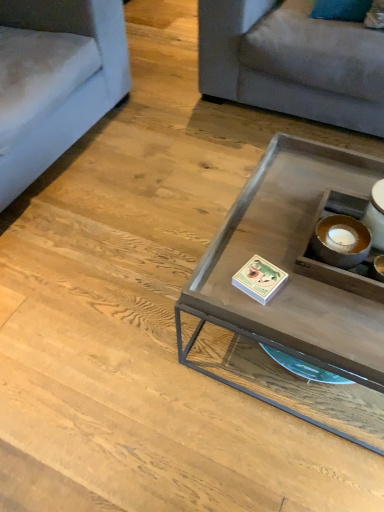
Locate an element on the screen. Image resolution: width=384 pixels, height=512 pixels. light blue fabric couch at left, which is the second studio couch in right-to-left order is located at coordinates (55, 80).

This screenshot has height=512, width=384. Describe the element at coordinates (55, 80) in the screenshot. I see `light blue fabric couch at left, which is the second studio couch in right-to-left order` at that location.

Describe the element at coordinates (292, 62) in the screenshot. I see `light gray fabric couch at upper right, which is counted as the second studio couch, starting from the left` at that location.

Describe the element at coordinates (295, 294) in the screenshot. I see `matte glass coffee table at center` at that location.

This screenshot has width=384, height=512. Identify the location of light blue fabric couch at left, acting as the first studio couch starting from the left. (55, 80).

Is matte glass coffee table at center taller than light blue fabric couch at left, acting as the first studio couch starting from the left?

No, matte glass coffee table at center is not taller than light blue fabric couch at left, acting as the first studio couch starting from the left.

Considering the relative positions of matte glass coffee table at center and light blue fabric couch at left, acting as the first studio couch starting from the left, in the image provided, is matte glass coffee table at center behind light blue fabric couch at left, acting as the first studio couch starting from the left,?

No, it is not.

Is matte glass coffee table at center positioned with its back to light blue fabric couch at left, acting as the first studio couch starting from the left?

matte glass coffee table at center does not have its back to light blue fabric couch at left, acting as the first studio couch starting from the left.

From the image's perspective, which studio couch is the 1st one above the matte glass coffee table at center? Please provide its 2D coordinates.

[(55, 80)]

Measure the distance from matte glass coffee table at center to light gray fabric couch at upper right, which is counted as the second studio couch, starting from the left.

matte glass coffee table at center is 36.88 inches from light gray fabric couch at upper right, which is counted as the second studio couch, starting from the left.

Considering the relative sizes of matte glass coffee table at center and light gray fabric couch at upper right, the 1th studio couch from the right, in the image provided, is matte glass coffee table at center wider than light gray fabric couch at upper right, the 1th studio couch from the right,?

No, matte glass coffee table at center is not wider than light gray fabric couch at upper right, the 1th studio couch from the right.

You are a GUI agent. You are given a task and a screenshot of the screen. Output one action in this format:
    pyautogui.click(x=<x>, y=<y>)
    Task: Click on the 2nd studio couch behind the matte glass coffee table at center
    This screenshot has width=384, height=512.
    Given the screenshot: What is the action you would take?
    pyautogui.click(x=292, y=62)

What's the angular difference between matte glass coffee table at center and light gray fabric couch at upper right, the 1th studio couch from the right,'s facing directions?

The facing directions of matte glass coffee table at center and light gray fabric couch at upper right, the 1th studio couch from the right, are 89.8 degrees apart.

Considering the positions of objects light blue fabric couch at left, which is the second studio couch in right-to-left order, and matte glass coffee table at center in the image provided, who is more to the right, light blue fabric couch at left, which is the second studio couch in right-to-left order, or matte glass coffee table at center?

Positioned to the right is matte glass coffee table at center.

Is there a large distance between light blue fabric couch at left, which is the second studio couch in right-to-left order, and matte glass coffee table at center?

Indeed, light blue fabric couch at left, which is the second studio couch in right-to-left order, is not near matte glass coffee table at center.

Which object is closer to the camera, light blue fabric couch at left, which is the second studio couch in right-to-left order, or matte glass coffee table at center?

Positioned in front is matte glass coffee table at center.

How different are the orientations of light blue fabric couch at left, which is the second studio couch in right-to-left order, and matte glass coffee table at center in degrees?

88.6 degrees separate the facing orientations of light blue fabric couch at left, which is the second studio couch in right-to-left order, and matte glass coffee table at center.

Is light gray fabric couch at upper right, which is counted as the second studio couch, starting from the left, shorter than matte glass coffee table at center?

No, light gray fabric couch at upper right, which is counted as the second studio couch, starting from the left, is not shorter than matte glass coffee table at center.

In terms of width, does light gray fabric couch at upper right, which is counted as the second studio couch, starting from the left, look wider or thinner when compared to matte glass coffee table at center?

Considering their sizes, light gray fabric couch at upper right, which is counted as the second studio couch, starting from the left, looks broader than matte glass coffee table at center.

In the image, there is a light gray fabric couch at upper right, the 1th studio couch from the right. Identify the location of coffee table below it (from the image's perspective). The height and width of the screenshot is (512, 384). (295, 294).

Which object is wider, light blue fabric couch at left, acting as the first studio couch starting from the left, or light gray fabric couch at upper right, the 1th studio couch from the right?

light gray fabric couch at upper right, the 1th studio couch from the right.

Who is smaller, light blue fabric couch at left, acting as the first studio couch starting from the left, or light gray fabric couch at upper right, the 1th studio couch from the right?

Smaller between the two is light gray fabric couch at upper right, the 1th studio couch from the right.

Which of these two, light blue fabric couch at left, acting as the first studio couch starting from the left, or light gray fabric couch at upper right, which is counted as the second studio couch, starting from the left, stands shorter?

light gray fabric couch at upper right, which is counted as the second studio couch, starting from the left, is shorter.

How many degrees apart are the facing directions of light blue fabric couch at left, which is the second studio couch in right-to-left order, and light gray fabric couch at upper right, the 1th studio couch from the right?

The angular difference between light blue fabric couch at left, which is the second studio couch in right-to-left order, and light gray fabric couch at upper right, the 1th studio couch from the right, is 1.15 degrees.

Is light gray fabric couch at upper right, which is counted as the second studio couch, starting from the left, not inside light blue fabric couch at left, which is the second studio couch in right-to-left order?

Yes, light gray fabric couch at upper right, which is counted as the second studio couch, starting from the left, is not within light blue fabric couch at left, which is the second studio couch in right-to-left order.

From their relative heights in the image, would you say light gray fabric couch at upper right, the 1th studio couch from the right, is taller or shorter than light blue fabric couch at left, acting as the first studio couch starting from the left?

Clearly, light gray fabric couch at upper right, the 1th studio couch from the right, is shorter compared to light blue fabric couch at left, acting as the first studio couch starting from the left.

From a real-world perspective, which object rests below the other?

light gray fabric couch at upper right, the 1th studio couch from the right, is physically lower.

This screenshot has width=384, height=512. Find the location of `the 1st studio couch above the matte glass coffee table at center (from the image's perspective)`. the 1st studio couch above the matte glass coffee table at center (from the image's perspective) is located at coordinates pos(55,80).

Where is `studio couch that is the 2nd one when counting backward from the matte glass coffee table at center`? Image resolution: width=384 pixels, height=512 pixels. studio couch that is the 2nd one when counting backward from the matte glass coffee table at center is located at coordinates (292, 62).

Estimate the real-world distances between objects in this image. Which object is closer to light blue fabric couch at left, acting as the first studio couch starting from the left, matte glass coffee table at center or light gray fabric couch at upper right, the 1th studio couch from the right?

The object closer to light blue fabric couch at left, acting as the first studio couch starting from the left, is light gray fabric couch at upper right, the 1th studio couch from the right.

Considering their positions, is light blue fabric couch at left, which is the second studio couch in right-to-left order, positioned further to matte glass coffee table at center than light gray fabric couch at upper right, which is counted as the second studio couch, starting from the left?

light blue fabric couch at left, which is the second studio couch in right-to-left order, is further to matte glass coffee table at center.

Based on their spatial positions, is light blue fabric couch at left, which is the second studio couch in right-to-left order, or matte glass coffee table at center further from light gray fabric couch at upper right, which is counted as the second studio couch, starting from the left?

matte glass coffee table at center is positioned further to the anchor light gray fabric couch at upper right, which is counted as the second studio couch, starting from the left.

Looking at the image, which one is located closer to light gray fabric couch at upper right, which is counted as the second studio couch, starting from the left, matte glass coffee table at center or light blue fabric couch at left, which is the second studio couch in right-to-left order?

Based on the image, light blue fabric couch at left, which is the second studio couch in right-to-left order, appears to be nearer to light gray fabric couch at upper right, which is counted as the second studio couch, starting from the left.

When comparing their distances from matte glass coffee table at center, does light gray fabric couch at upper right, the 1th studio couch from the right, or light blue fabric couch at left, acting as the first studio couch starting from the left, seem further?

Based on the image, light blue fabric couch at left, acting as the first studio couch starting from the left, appears to be further to matte glass coffee table at center.

Estimate the real-world distances between objects in this image. Which object is closer to light blue fabric couch at left, acting as the first studio couch starting from the left, light gray fabric couch at upper right, which is counted as the second studio couch, starting from the left, or matte glass coffee table at center?

light gray fabric couch at upper right, which is counted as the second studio couch, starting from the left.

At what (x,y) coordinates should I click in order to perform the action: click on coffee table between light blue fabric couch at left, acting as the first studio couch starting from the left, and light gray fabric couch at upper right, the 1th studio couch from the right. Please return your answer as a coordinate pair (x, y). This screenshot has width=384, height=512. Looking at the image, I should click on (295, 294).